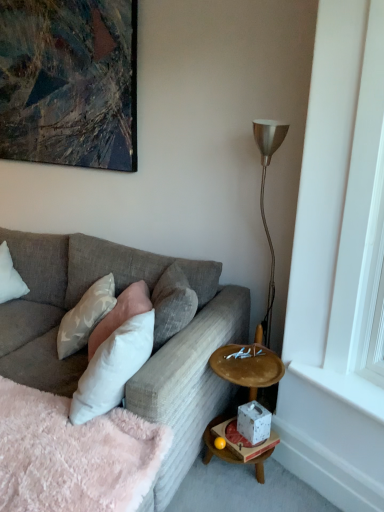
Question: From the image's perspective, is metallic abstract painting at upper left located beneath textured gray couch at center?

Choices:
 (A) no
 (B) yes

Answer: (A)

Question: Is metallic abstract painting at upper left not inside textured gray couch at center?

Choices:
 (A) no
 (B) yes

Answer: (B)

Question: Is metallic abstract painting at upper left positioned behind textured gray couch at center?

Choices:
 (A) no
 (B) yes

Answer: (B)

Question: Does metallic abstract painting at upper left have a greater height compared to textured gray couch at center?

Choices:
 (A) no
 (B) yes

Answer: (B)

Question: Is metallic abstract painting at upper left thinner than textured gray couch at center?

Choices:
 (A) yes
 (B) no

Answer: (A)

Question: Is white speckled ceramic at lower right in front of or behind white paper tissue box at lower right in the image?

Choices:
 (A) front
 (B) behind

Answer: (B)

Question: Is point (258, 439) closer or farther from the camera than point (268, 451)?

Choices:
 (A) farther
 (B) closer

Answer: (B)

Question: Looking at the image, does white speckled ceramic at lower right seem bigger or smaller compared to white paper tissue box at lower right?

Choices:
 (A) big
 (B) small

Answer: (A)

Question: From the image's perspective, relative to white paper tissue box at lower right, is white speckled ceramic at lower right above or below?

Choices:
 (A) above
 (B) below

Answer: (A)

Question: Based on their sizes in the image, would you say white speckled ceramic at lower right is bigger or smaller than white soft pillow at center, acting as the second pillow starting from the right?

Choices:
 (A) small
 (B) big

Answer: (A)

Question: Considering the relative positions of white speckled ceramic at lower right and white soft pillow at center, acting as the second pillow starting from the right, in the image provided, is white speckled ceramic at lower right to the left or to the right of white soft pillow at center, acting as the second pillow starting from the right,?

Choices:
 (A) right
 (B) left

Answer: (A)

Question: Considering the positions of white speckled ceramic at lower right and white soft pillow at center, the second pillow viewed from the left, in the image, is white speckled ceramic at lower right wider or thinner than white soft pillow at center, the second pillow viewed from the left,?

Choices:
 (A) wide
 (B) thin

Answer: (B)

Question: From the image's perspective, is white speckled ceramic at lower right positioned above or below white soft pillow at center, the second pillow viewed from the left?

Choices:
 (A) above
 (B) below

Answer: (B)

Question: From the image's perspective, is metallic abstract painting at upper left above or below white speckled ceramic at lower right?

Choices:
 (A) above
 (B) below

Answer: (A)

Question: Looking at their shapes, would you say metallic abstract painting at upper left is wider or thinner than white speckled ceramic at lower right?

Choices:
 (A) wide
 (B) thin

Answer: (B)